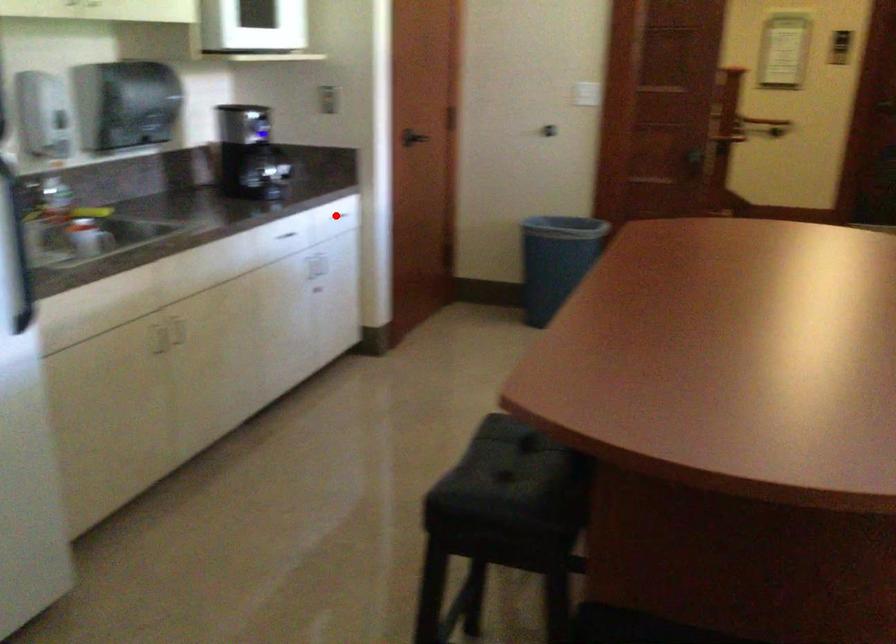
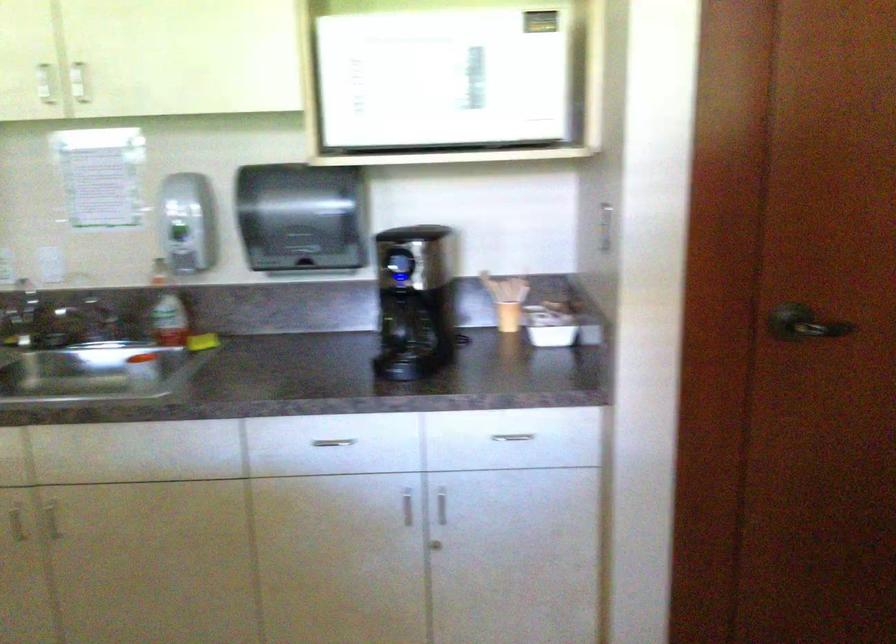
Question: A red point is marked in image1. In image2, is the corresponding 3D point closer to the camera or farther? Reply with the corresponding letter.

Choices:
 (A) The corresponding 3D point is closer.
 (B) The corresponding 3D point is farther.

Answer: (A)